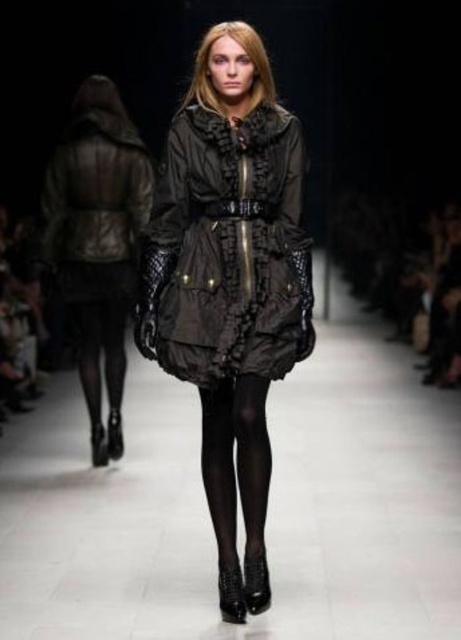
Question: Considering the real-world distances, which object is closest to the black sheer tights at center?

Choices:
 (A) matte black dress at center
 (B) matte black coat at center

Answer: (B)

Question: Which of the following is the closest to the observer?

Choices:
 (A) (232, 259)
 (B) (278, 168)

Answer: (A)

Question: Is matte black dress at center above black sheer tights at center?

Choices:
 (A) no
 (B) yes

Answer: (B)

Question: Is matte black coat at center to the right of black sheer tights at center from the viewer's perspective?

Choices:
 (A) no
 (B) yes

Answer: (A)

Question: Is matte black coat at center wider than matte black dress at center?

Choices:
 (A) no
 (B) yes

Answer: (B)

Question: Which object is farther from the camera taking this photo?

Choices:
 (A) black sheer tights at center
 (B) leather-like brown coat at left
 (C) matte black dress at center
 (D) matte black coat at center

Answer: (B)